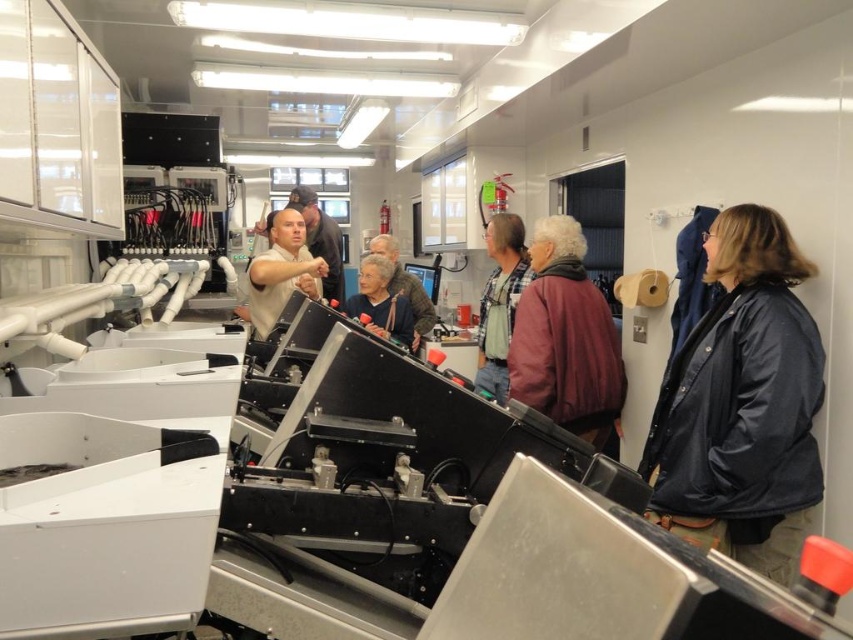
In the scene shown: Who is positioned more to the right, maroon fabric jacket at center or plaid shirt at center?

From the viewer's perspective, maroon fabric jacket at center appears more on the right side.

Is point (556, 230) closer to viewer compared to point (479, 342)?

Yes, it is.

Find the location of a particular element. The width and height of the screenshot is (853, 640). maroon fabric jacket at center is located at coordinates (566, 339).

Is dark blue jacket at right closer to camera compared to matte white shirt at center?

Yes, dark blue jacket at right is in front of matte white shirt at center.

Where is `dark blue jacket at right`? dark blue jacket at right is located at coordinates (741, 404).

Which is behind, point (781, 237) or point (293, 237)?

Point (293, 237)

You are a GUI agent. You are given a task and a screenshot of the screen. Output one action in this format:
    pyautogui.click(x=<x>, y=<y>)
    Task: Click on the dark blue jacket at right
    
    Given the screenshot: What is the action you would take?
    pyautogui.click(x=741, y=404)

Does plaid shirt at center appear on the right side of matte white shirt at center?

Correct, you'll find plaid shirt at center to the right of matte white shirt at center.

Who is more forward, [525,262] or [271,264]?

Point [271,264]

You are a GUI agent. You are given a task and a screenshot of the screen. Output one action in this format:
    pyautogui.click(x=<x>, y=<y>)
    Task: Click on the plaid shirt at center
    
    Given the screenshot: What is the action you would take?
    pyautogui.click(x=500, y=300)